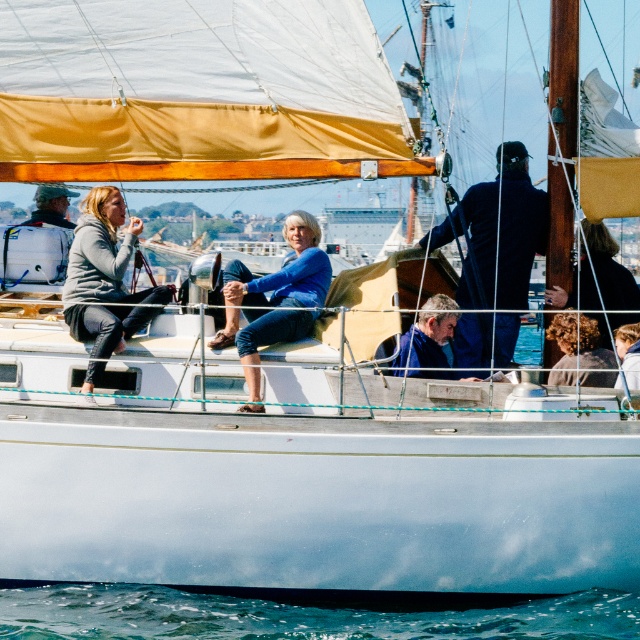
Question: Which is farther from the curly hair at center?

Choices:
 (A) brown wooden mast at upper center
 (B) dark brown leather jacket at lower right
 (C) gray fabric jacket at center
 (D) smooth brown hair at center

Answer: (B)

Question: Is brown wooden mast at upper center positioned behind curly hair at center?

Choices:
 (A) no
 (B) yes

Answer: (B)

Question: Which of the following is the closest to the observer?

Choices:
 (A) gray fabric jacket at center
 (B) dark brown leather jacket at lower right
 (C) blue water at lower left

Answer: (C)

Question: Does gray fleece jacket at left have a lesser width compared to smooth brown hair at center?

Choices:
 (A) no
 (B) yes

Answer: (A)

Question: Which of the following is the farthest from the observer?

Choices:
 (A) (285, 636)
 (B) (148, 314)
 (C) (508, 333)

Answer: (C)

Question: Is blue water at lower left above smooth brown hair at center?

Choices:
 (A) yes
 (B) no

Answer: (B)